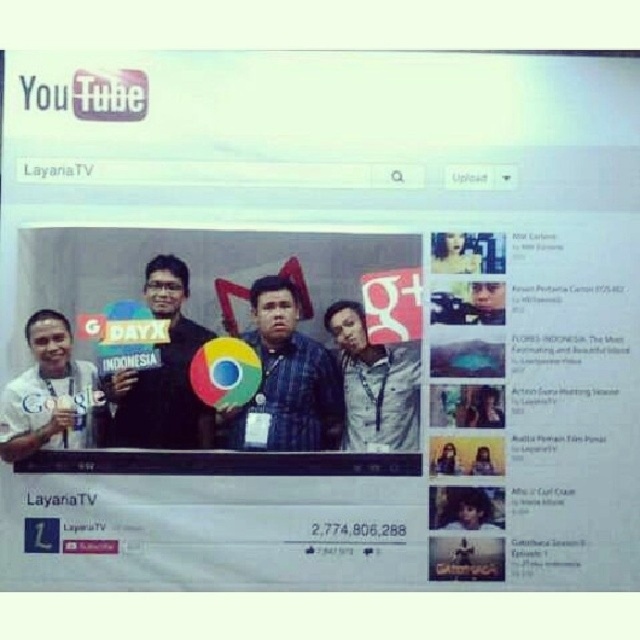
Who is positioned more to the right, matte blue shirt at center or denim jacket at center?

From the viewer's perspective, denim jacket at center appears more on the right side.

This screenshot has width=640, height=640. Find the location of `matte blue shirt at center`. matte blue shirt at center is located at coordinates (288, 378).

Locate an element on the screen. This screenshot has width=640, height=640. matte blue shirt at center is located at coordinates (288, 378).

Who is positioned more to the right, matte blue shirt at center or black matte shirt at center?

Positioned to the right is matte blue shirt at center.

Can you confirm if matte blue shirt at center is positioned below black matte shirt at center?

Yes, matte blue shirt at center is below black matte shirt at center.

Which is behind, point (282, 440) or point (156, 305)?

The point (282, 440) is more distant.

Where is `matte blue shirt at center`? The width and height of the screenshot is (640, 640). matte blue shirt at center is located at coordinates (288, 378).

Based on the photo, which of these two, black matte shirt at center or white matte shirt at left, stands shorter?

white matte shirt at left is shorter.

Is black matte shirt at center to the left of white matte shirt at left from the viewer's perspective?

No, black matte shirt at center is not to the left of white matte shirt at left.

The width and height of the screenshot is (640, 640). What do you see at coordinates (163, 372) in the screenshot?
I see `black matte shirt at center` at bounding box center [163, 372].

This screenshot has height=640, width=640. In order to click on black matte shirt at center in this screenshot , I will do `click(163, 372)`.